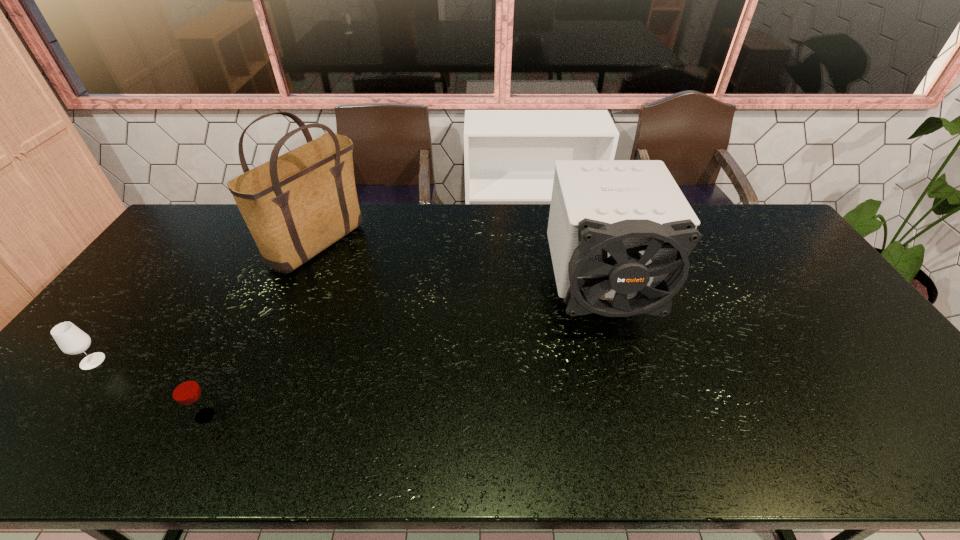
Find the location of a particular element. object that can be found as the second closest to the nearest object is located at coordinates tap(296, 205).

Identify the location of object that is the second closest one to the farther glass. (296, 205).

Where is `blank space that satisfies the following two spatial constraints: 1. on the back side of the tote bag; 2. on the left side of the nearer glass`? blank space that satisfies the following two spatial constraints: 1. on the back side of the tote bag; 2. on the left side of the nearer glass is located at coordinates (292, 242).